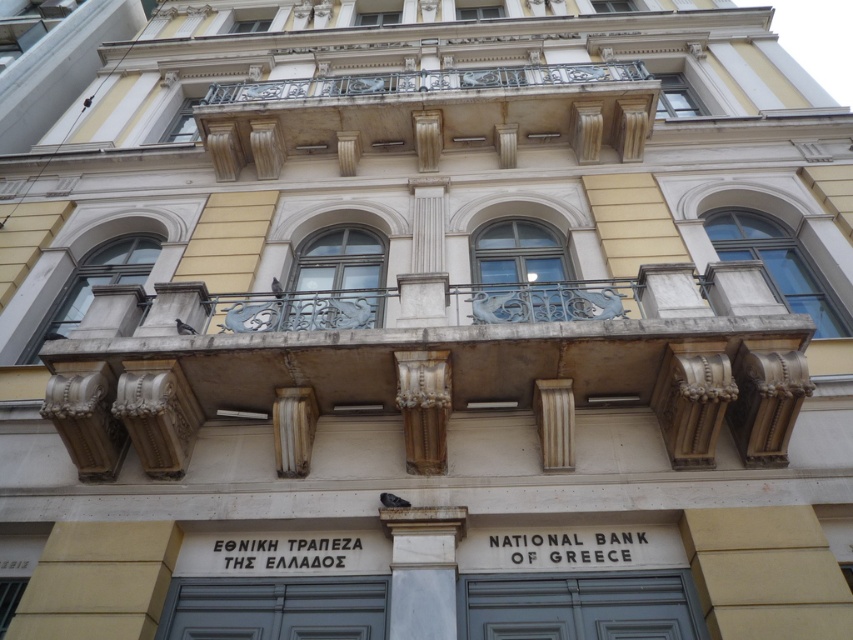
Does stone balustrade at center have a lesser width compared to gold textured column at center?

No, stone balustrade at center is not thinner than gold textured column at center.

Does stone balustrade at center have a greater height compared to gold textured column at center?

Yes, stone balustrade at center is taller than gold textured column at center.

Is point (154, 440) less distant than point (399, 380)?

That is False.

The height and width of the screenshot is (640, 853). I want to click on stone balustrade at center, so click(451, 381).

Who is positioned more to the left, gold textured balcony at upper center or white marble column at center?

gold textured balcony at upper center is more to the left.

Which is more to the right, gold textured balcony at upper center or white marble column at center?

Positioned to the right is white marble column at center.

Does point (257, 156) come farther from viewer compared to point (398, 513)?

Yes, point (257, 156) is farther from viewer.

You are a GUI agent. You are given a task and a screenshot of the screen. Output one action in this format:
    pyautogui.click(x=<x>, y=<y>)
    Task: Click on the gold textured balcony at upper center
    The height and width of the screenshot is (640, 853).
    Given the screenshot: What is the action you would take?
    pyautogui.click(x=427, y=113)

Does stone balustrade at center have a greater height compared to smooth beige column at center?

Yes, stone balustrade at center is taller than smooth beige column at center.

Is stone balustrade at center closer to the viewer compared to smooth beige column at center?

Yes, it is in front of smooth beige column at center.

This screenshot has height=640, width=853. Describe the element at coordinates (451, 381) in the screenshot. I see `stone balustrade at center` at that location.

Locate an element on the screen. stone balustrade at center is located at coordinates (451, 381).